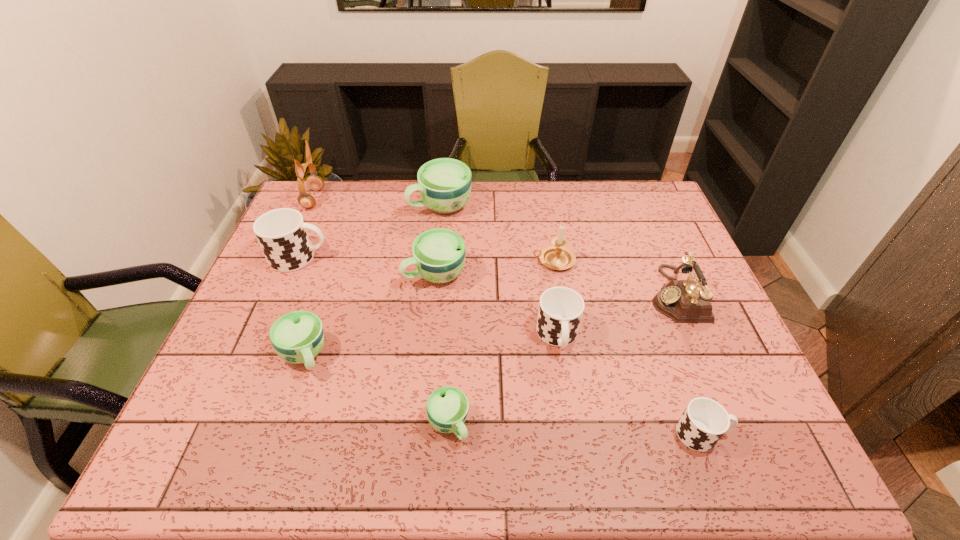
Find the location of a particular element. The width and height of the screenshot is (960, 540). vacant space situated with a handle on the side of the beige candle holder is located at coordinates (405, 261).

Identify the location of free space located 0.070m with a handle on the side of the beige candle holder. (509, 261).

Find the location of a particular element. The image size is (960, 540). vacant space situated on the side of the biggest black cup with the handle is located at coordinates (412, 258).

Identify the location of vacant area situated 0.280m on the dial of the telephone. This screenshot has width=960, height=540. (548, 294).

What are the coordinates of `vacant space located 0.320m on the dial of the telephone` in the screenshot? It's located at (534, 294).

Where is `vacant space located on the dial of the telephone`? The height and width of the screenshot is (540, 960). vacant space located on the dial of the telephone is located at coordinates (534, 294).

Image resolution: width=960 pixels, height=540 pixels. I want to click on free region located on the left of the second farthest blue cup, so click(349, 273).

The width and height of the screenshot is (960, 540). What are the coordinates of `vacant space located 0.150m on the side of the second black cup from left to right with the handle` in the screenshot? It's located at (570, 417).

Image resolution: width=960 pixels, height=540 pixels. What are the coordinates of `vacant space positioned on the left of the second smallest blue cup` in the screenshot? It's located at (222, 355).

You are a GUI agent. You are given a task and a screenshot of the screen. Output one action in this format:
    pyautogui.click(x=<x>, y=<y>)
    Task: Click on the vacant region located 0.050m on the side of the smallest black cup with the handle
    The height and width of the screenshot is (540, 960).
    Given the screenshot: What is the action you would take?
    pyautogui.click(x=751, y=434)